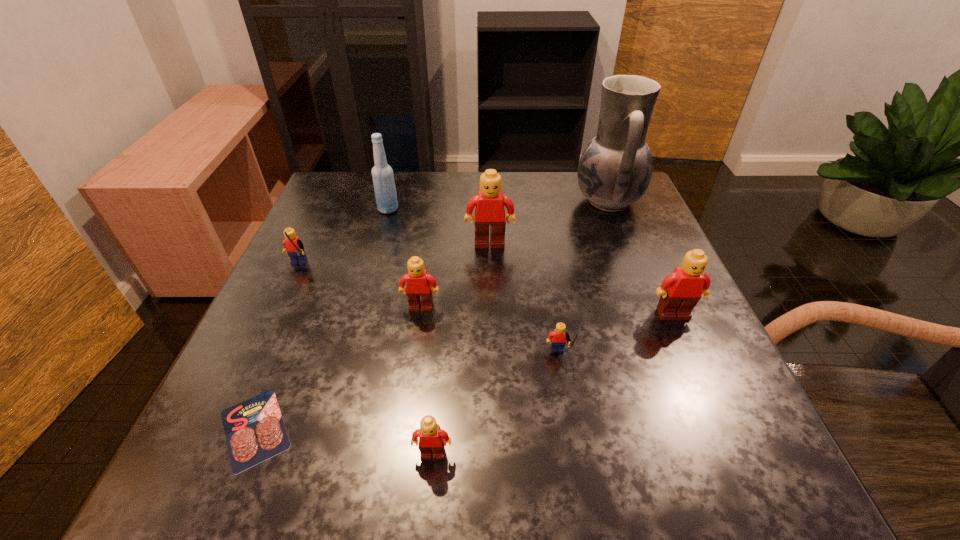
At what (x,y) coordinates should I click in order to perform the action: click on the right yellow Lego. Please return your answer as a coordinate pair (x, y). This screenshot has width=960, height=540. Looking at the image, I should click on (557, 338).

The image size is (960, 540). In order to click on the smallest brown Lego in this screenshot , I will do `click(432, 439)`.

Identify the location of the nearest Lego. The height and width of the screenshot is (540, 960). (432, 439).

Locate an element on the screen. salami is located at coordinates (254, 429).

Where is `vacant space located on the front-facing side of the pitcher`? The width and height of the screenshot is (960, 540). vacant space located on the front-facing side of the pitcher is located at coordinates (538, 201).

Image resolution: width=960 pixels, height=540 pixels. I want to click on vacant region located on the front-facing side of the pitcher, so click(474, 201).

This screenshot has height=540, width=960. I want to click on vacant space situated 0.200m on the front-facing side of the pitcher, so click(494, 201).

At what (x,y) coordinates should I click in order to perform the action: click on free space located on the front of the seventh object from right to left. Please return your answer as a coordinate pair (x, y). Looking at the image, I should click on (372, 266).

Identify the location of free space located on the face of the farthest Lego. (493, 381).

I want to click on vacant space situated on the face of the second biggest brown Lego, so click(x=701, y=377).